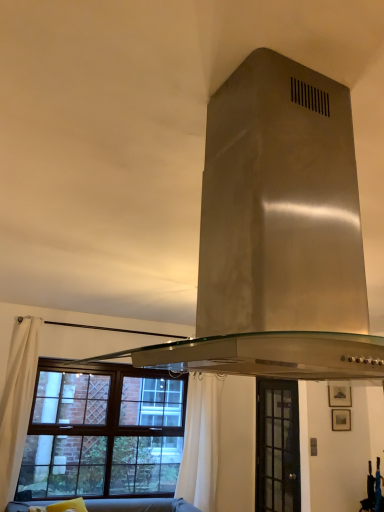
Question: Is the depth of soft gray fabric couch at lower center greater than that of clear glass door at center, which ranks as the 1th window in right-to-left order?

Choices:
 (A) yes
 (B) no

Answer: (B)

Question: From a real-world perspective, is soft gray fabric couch at lower center located higher than clear glass door at center, which is counted as the second window, starting from the left?

Choices:
 (A) no
 (B) yes

Answer: (A)

Question: Is the depth of soft gray fabric couch at lower center less than that of clear glass door at center, which is counted as the second window, starting from the left?

Choices:
 (A) yes
 (B) no

Answer: (A)

Question: Is soft gray fabric couch at lower center at the left side of clear glass door at center, which is counted as the second window, starting from the left?

Choices:
 (A) yes
 (B) no

Answer: (A)

Question: Is soft gray fabric couch at lower center next to clear glass door at center, which is counted as the second window, starting from the left, and touching it?

Choices:
 (A) no
 (B) yes

Answer: (A)

Question: In terms of height, does stainless steel exhaust hood at center look taller or shorter compared to white fabric curtain at left, which is the first curtain in left-to-right order?

Choices:
 (A) short
 (B) tall

Answer: (A)

Question: In the image, is stainless steel exhaust hood at center on the left side or the right side of white fabric curtain at left, which is counted as the 2th curtain, starting from the right?

Choices:
 (A) left
 (B) right

Answer: (B)

Question: From the image's perspective, is stainless steel exhaust hood at center located above or below white fabric curtain at left, which is the 2th curtain from back to front?

Choices:
 (A) below
 (B) above

Answer: (B)

Question: Is stainless steel exhaust hood at center in front of or behind white fabric curtain at left, which is the first curtain in left-to-right order, in the image?

Choices:
 (A) behind
 (B) front

Answer: (B)

Question: Is clear glass door at center, which ranks as the 1th window in right-to-left order, wider or thinner than stainless steel exhaust hood at center?

Choices:
 (A) wide
 (B) thin

Answer: (B)

Question: Is clear glass door at center, which is counted as the second window, starting from the left, in front of or behind stainless steel exhaust hood at center in the image?

Choices:
 (A) behind
 (B) front

Answer: (A)

Question: Visually, is clear glass door at center, which is counted as the second window, starting from the left, positioned to the left or to the right of stainless steel exhaust hood at center?

Choices:
 (A) left
 (B) right

Answer: (B)

Question: Which is correct: clear glass door at center, which ranks as the 1th window in right-to-left order, is inside stainless steel exhaust hood at center, or outside of it?

Choices:
 (A) outside
 (B) inside

Answer: (A)

Question: From a real-world perspective, is white fabric curtain at left, marked as the 1th curtain in a front-to-back arrangement, above or below white fabric curtain at lower center, arranged as the second curtain when viewed from the front?

Choices:
 (A) above
 (B) below

Answer: (A)

Question: Is white fabric curtain at left, which is counted as the 2th curtain, starting from the right, to the left or to the right of white fabric curtain at lower center, positioned as the 1th curtain in back-to-front order, in the image?

Choices:
 (A) left
 (B) right

Answer: (A)